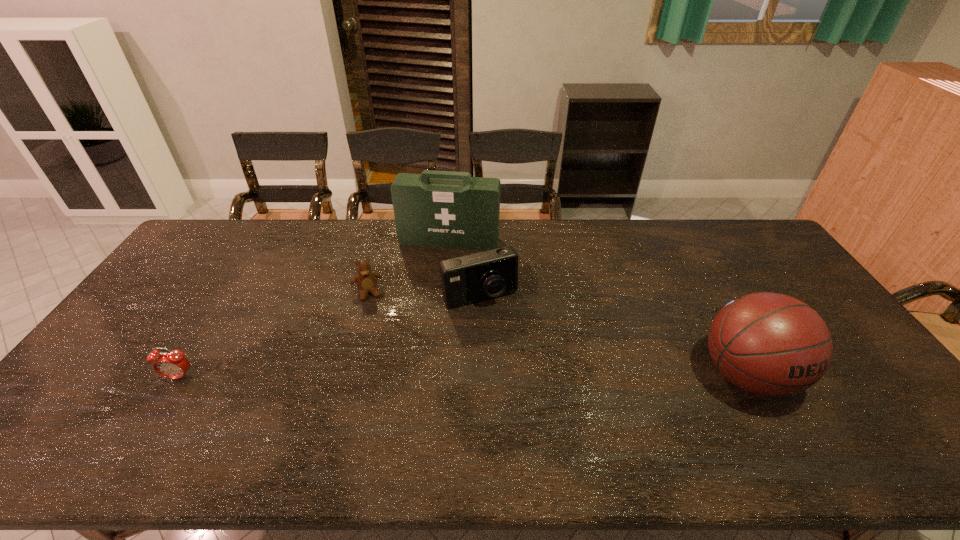
At what (x,y) coordinates should I click in order to perform the action: click on vacant area located 0.200m on the front-facing side of the first-aid kit. Please return your answer as a coordinate pair (x, y). This screenshot has width=960, height=540. Looking at the image, I should click on (432, 290).

At what (x,y) coordinates should I click in order to perform the action: click on free space located 0.330m on the front-facing side of the first-aid kit. Please return your answer as a coordinate pair (x, y). The height and width of the screenshot is (540, 960). Looking at the image, I should click on (423, 319).

Locate an element on the screen. This screenshot has width=960, height=540. vacant region located on the front-facing side of the first-aid kit is located at coordinates (439, 266).

This screenshot has height=540, width=960. Identify the location of vacant space located 0.250m on the front-facing side of the third tallest object. (522, 375).

Image resolution: width=960 pixels, height=540 pixels. What are the coordinates of `vacant space situated 0.360m on the front-facing side of the third tallest object` in the screenshot? It's located at (539, 411).

Image resolution: width=960 pixels, height=540 pixels. Find the location of `vacant space situated on the front-facing side of the third tallest object`. vacant space situated on the front-facing side of the third tallest object is located at coordinates (514, 358).

Identify the location of object located in the far edge section of the desktop. (432, 209).

Identify the location of object located at the near edge. Image resolution: width=960 pixels, height=540 pixels. (769, 344).

Find the location of a particular element. The height and width of the screenshot is (540, 960). vacant space at the far edge of the desktop is located at coordinates (614, 243).

Identify the location of vacant area at the near edge of the desktop. (235, 400).